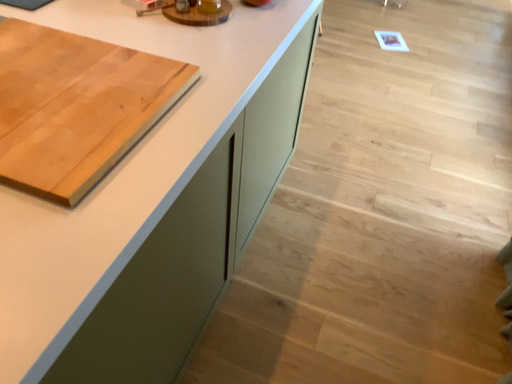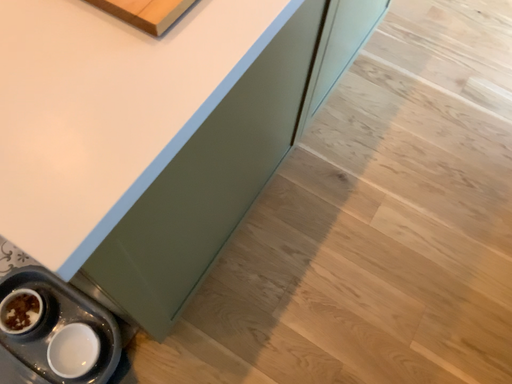
Question: Which way did the camera rotate in the video?

Choices:
 (A) rotated downward
 (B) rotated upward

Answer: (A)